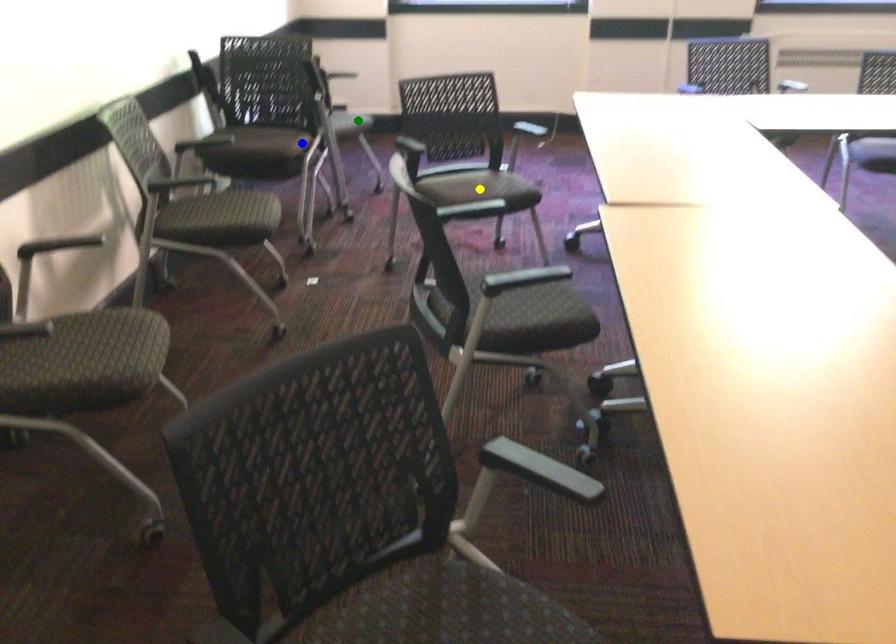
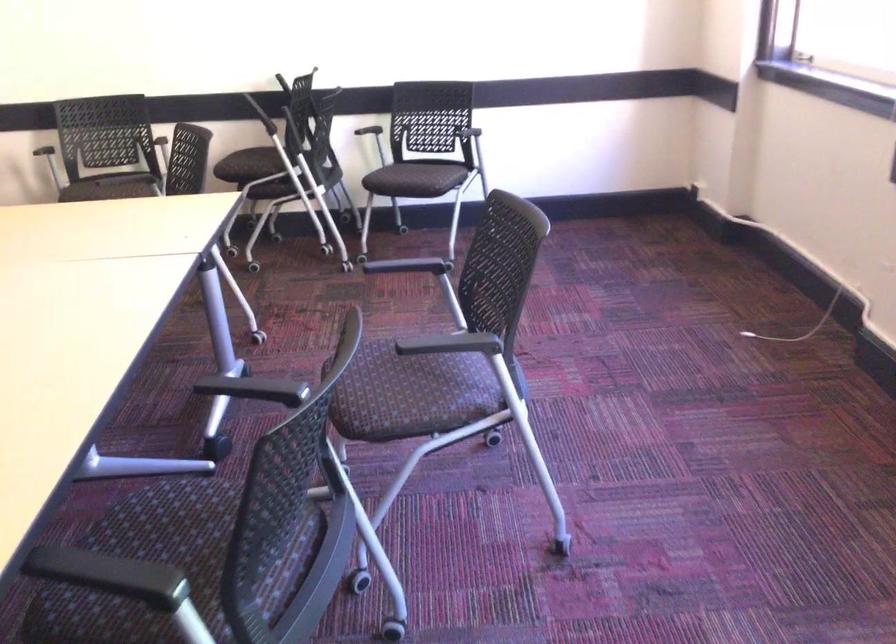
I am providing you with two images of the same scene from different viewpoints. Three points are marked in image1. Which point corresponds to a part or object that is occluded in image2?In image1, three points are marked. Which of them correspond to a part or object that is occluded in image2?Among the three points shown in image1, which one corresponds to a part or object that is no longer visible due to occlusion in image2?

yellow point